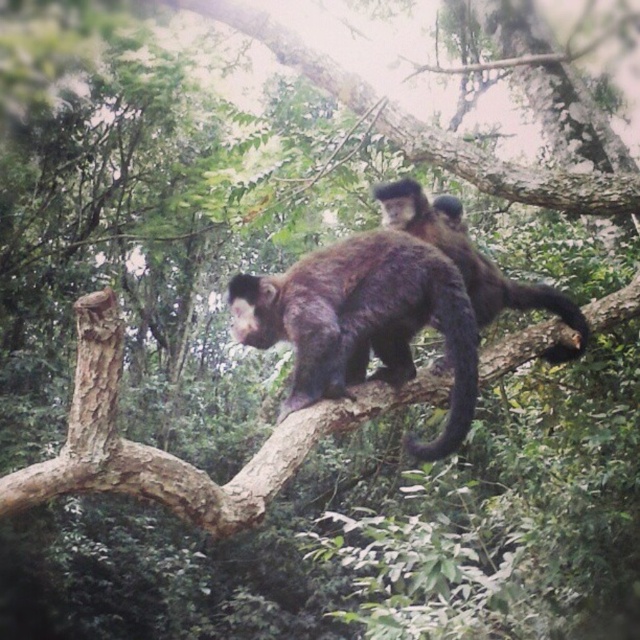
Question: Does fuzzy brown monkey at center have a larger size compared to brown rough tree branch at upper center?

Choices:
 (A) yes
 (B) no

Answer: (B)

Question: Which object is closer to the camera taking this photo?

Choices:
 (A) fuzzy brown monkey at center
 (B) brown furry tail at upper right

Answer: (A)

Question: Which of the following is the farthest from the observer?

Choices:
 (A) (449, 445)
 (B) (99, 321)
 (C) (502, 278)
 (D) (396, 320)

Answer: (C)

Question: Is fuzzy brown monkey at center further to the viewer compared to black furry tail at center?

Choices:
 (A) yes
 (B) no

Answer: (A)

Question: Where is brown rough tree branch at center located in relation to shiny brown fur monkey at center in the image?

Choices:
 (A) above
 (B) below

Answer: (B)

Question: Among these points, which one is farthest from the camera?

Choices:
 (A) (531, 307)
 (B) (364, 292)

Answer: (A)